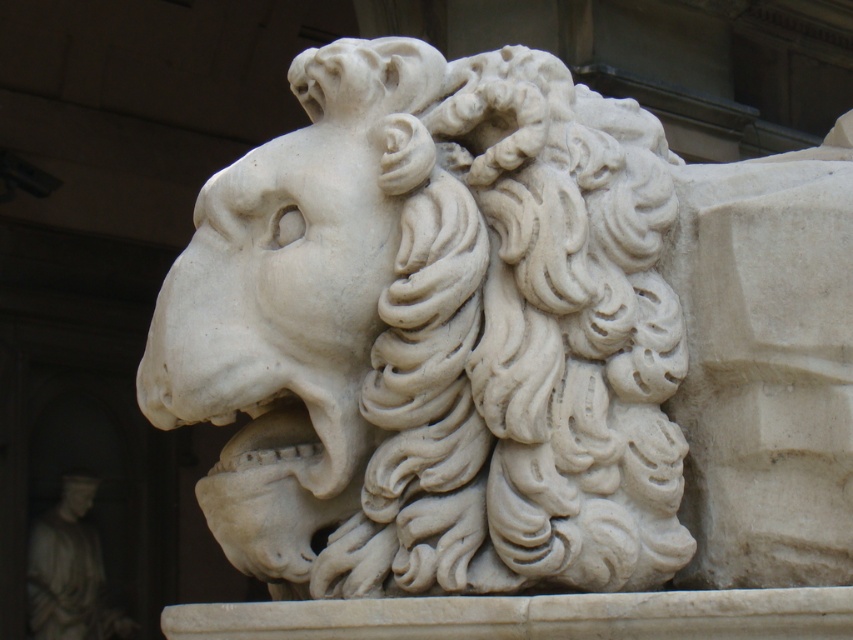
Is point (529, 300) positioned after point (77, 484)?

No, it is in front of (77, 484).

Does white marble lion at center appear on the left side of white marble lion at upper center?

Incorrect, white marble lion at center is not on the left side of white marble lion at upper center.

Does point (160, 365) come in front of point (57, 508)?

Yes, point (160, 365) is in front of point (57, 508).

The width and height of the screenshot is (853, 640). What are the coordinates of `white marble lion at center` in the screenshot? It's located at (434, 332).